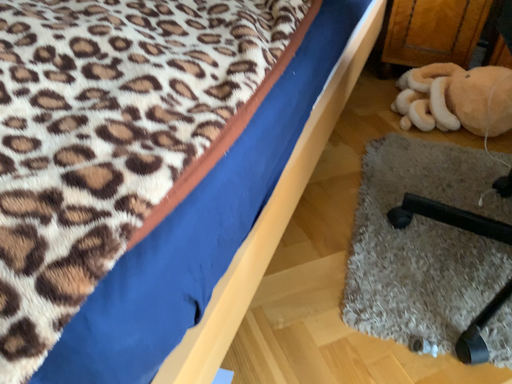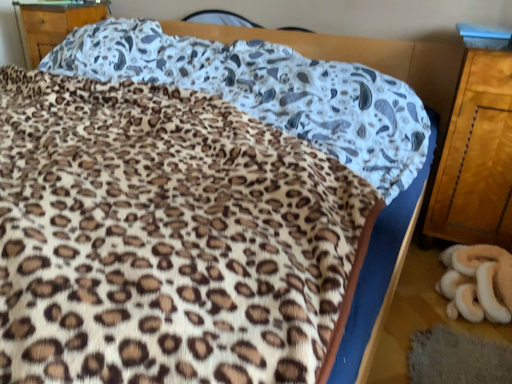
Question: How did the camera likely rotate when shooting the video?

Choices:
 (A) rotated downward
 (B) rotated upward

Answer: (B)